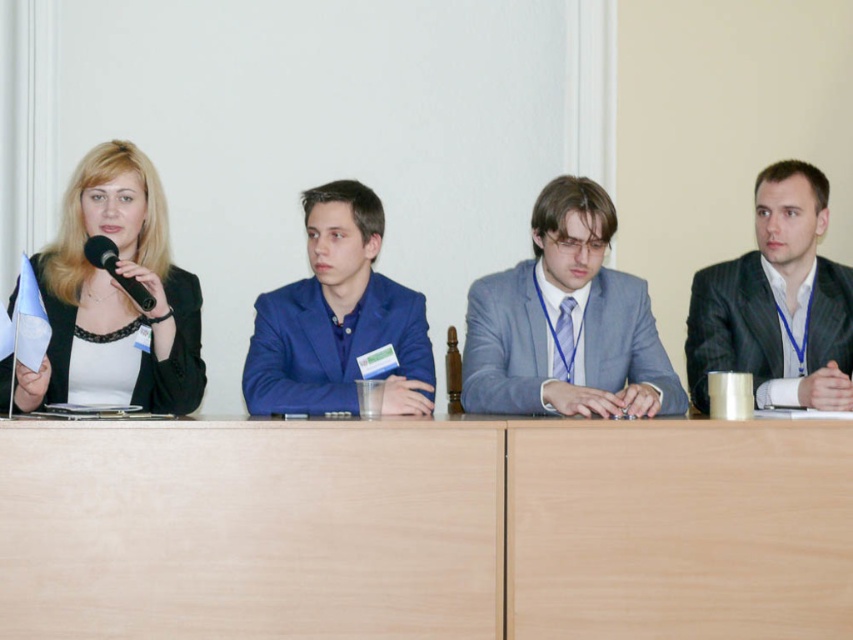
Does light gray suit at center appear over blue satin suit at center?

Indeed, light gray suit at center is positioned over blue satin suit at center.

Looking at this image, who is positioned more to the right, light gray suit at center or blue satin suit at center?

light gray suit at center

The width and height of the screenshot is (853, 640). In order to click on light gray suit at center in this screenshot , I will do `click(566, 323)`.

Who is more distant from viewer, (252, 385) or (99, 246)?

Point (252, 385)

Does blue satin suit at center have a smaller size compared to black plastic microphone at left?

No.

Is point (276, 355) positioned in front of point (152, 307)?

No, (276, 355) is further to viewer.

In order to click on blue satin suit at center in this screenshot , I will do `click(329, 346)`.

Does light brown wood table at center have a lesser height compared to black textured suit at right?

Indeed, light brown wood table at center has a lesser height compared to black textured suit at right.

Can you confirm if light brown wood table at center is wider than black textured suit at right?

Yes.

Between point (352, 630) and point (850, 289), which one is positioned behind?

Positioned behind is point (850, 289).

Where is `light brown wood table at center`? The height and width of the screenshot is (640, 853). light brown wood table at center is located at coordinates (426, 531).